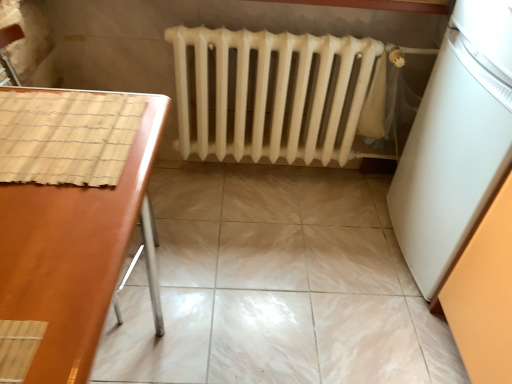
Question: Does brown glossy table at left come in front of white matte refrigerator at right?

Choices:
 (A) no
 (B) yes

Answer: (B)

Question: From a real-world perspective, is brown glossy table at left on top of white matte refrigerator at right?

Choices:
 (A) yes
 (B) no

Answer: (B)

Question: Is brown glossy table at left positioned behind white matte refrigerator at right?

Choices:
 (A) yes
 (B) no

Answer: (B)

Question: Does brown glossy table at left turn towards white matte refrigerator at right?

Choices:
 (A) no
 (B) yes

Answer: (B)

Question: Does brown glossy table at left have a greater height compared to white matte refrigerator at right?

Choices:
 (A) yes
 (B) no

Answer: (B)

Question: Does brown glossy table at left touch white matte refrigerator at right?

Choices:
 (A) no
 (B) yes

Answer: (A)

Question: From the image's perspective, is white matte radiator at center located beneath brown glossy table at left?

Choices:
 (A) yes
 (B) no

Answer: (B)

Question: Can you confirm if white matte radiator at center is wider than brown glossy table at left?

Choices:
 (A) no
 (B) yes

Answer: (A)

Question: Does white matte radiator at center have a larger size compared to brown glossy table at left?

Choices:
 (A) yes
 (B) no

Answer: (B)

Question: Does white matte radiator at center come in front of brown glossy table at left?

Choices:
 (A) no
 (B) yes

Answer: (A)

Question: From a real-world perspective, is white matte radiator at center over brown glossy table at left?

Choices:
 (A) no
 (B) yes

Answer: (A)

Question: Is white matte radiator at center oriented towards brown glossy table at left?

Choices:
 (A) yes
 (B) no

Answer: (A)

Question: Are marble tile floor at center and white matte refrigerator at right located far from each other?

Choices:
 (A) yes
 (B) no

Answer: (B)